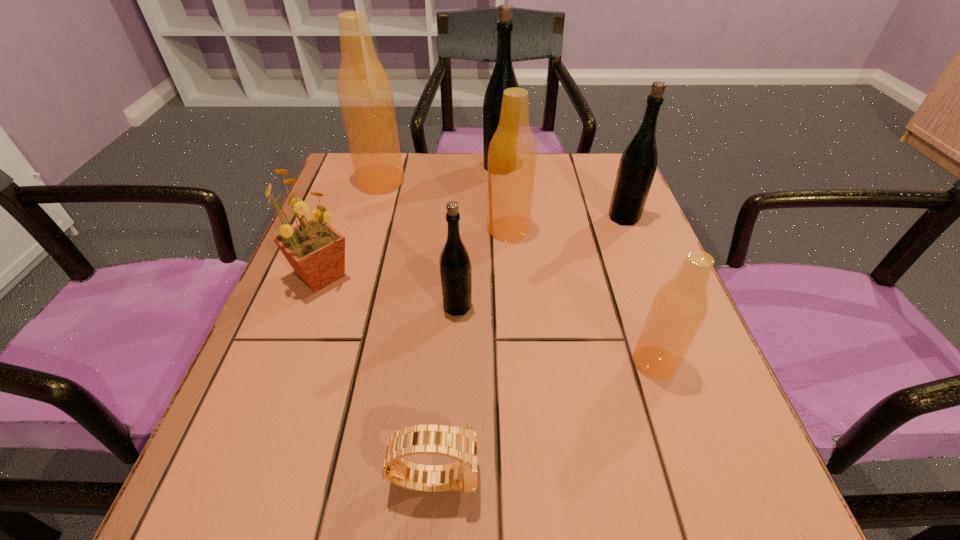
At what (x,y) coordinates should I click in order to perform the action: click on the smallest green beer bottle. Please return your answer as a coordinate pair (x, y). This screenshot has height=540, width=960. Looking at the image, I should click on (455, 267).

Locate an element on the screen. The width and height of the screenshot is (960, 540). the rightmost tan beer bottle is located at coordinates (680, 306).

Find the location of `the seventh farthest object`. the seventh farthest object is located at coordinates (680, 306).

I want to click on black watch, so click(461, 444).

Identify the location of the nearest object. The height and width of the screenshot is (540, 960). (461, 444).

This screenshot has width=960, height=540. Identify the location of vacant space located on the left of the farthest green beer bottle. (369, 167).

Identify the location of vacant space located on the front of the leftmost tan beer bottle. This screenshot has height=540, width=960. (354, 273).

This screenshot has width=960, height=540. What are the coordinates of `free space located 0.150m on the left of the rightmost green beer bottle` in the screenshot? It's located at (542, 217).

This screenshot has width=960, height=540. Find the location of `vacant space located on the front of the second nearest tan beer bottle`. vacant space located on the front of the second nearest tan beer bottle is located at coordinates (519, 371).

I want to click on blank space located at the front of the sunflower with flowers visible, so click(x=249, y=471).